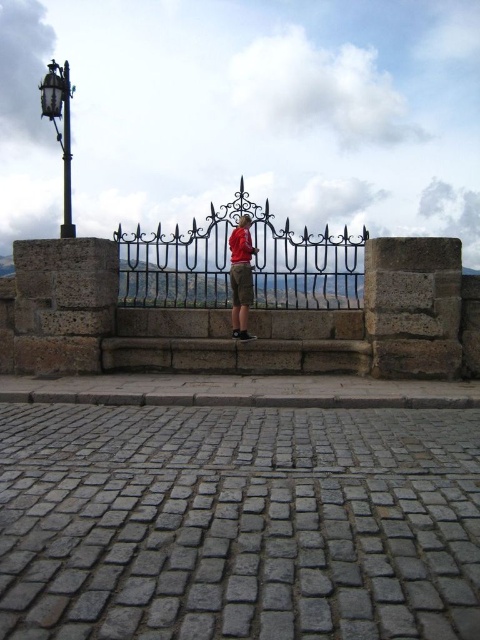
Question: Does wrought iron fence at center appear on the right side of red shirt at center?

Choices:
 (A) yes
 (B) no

Answer: (B)

Question: Can you confirm if wrought iron fence at center is positioned to the right of red shirt at center?

Choices:
 (A) no
 (B) yes

Answer: (A)

Question: Among these objects, which one is nearest to the camera?

Choices:
 (A) wrought iron fence at center
 (B) red shirt at center

Answer: (B)

Question: Is wrought iron fence at center to the right of red shirt at center from the viewer's perspective?

Choices:
 (A) yes
 (B) no

Answer: (B)

Question: Which point is farther to the camera?

Choices:
 (A) red shirt at center
 (B) wrought iron fence at center

Answer: (B)